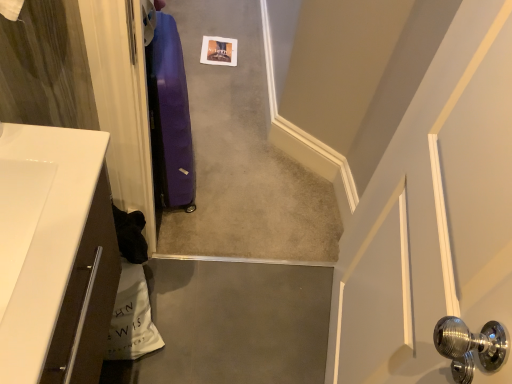
Question: Based on their positions, is purple fabric suitcase at center located to the left or right of purple fabric suitcase at left?

Choices:
 (A) left
 (B) right

Answer: (B)

Question: Is purple fabric suitcase at center inside or outside of purple fabric suitcase at left?

Choices:
 (A) outside
 (B) inside

Answer: (A)

Question: Which object is positioned closest to the purple fabric suitcase at center?

Choices:
 (A) purple fabric suitcase at left
 (B) white glossy countertop at lower left

Answer: (A)

Question: Which of these objects is positioned farthest from the purple fabric suitcase at center?

Choices:
 (A) purple fabric suitcase at left
 (B) white glossy countertop at lower left

Answer: (B)